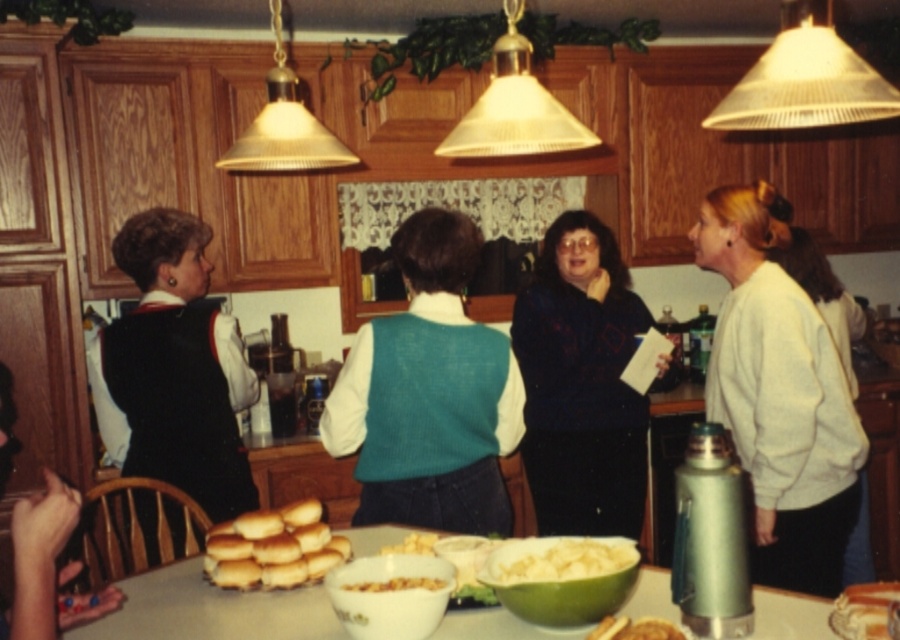
Question: Where is white sweater at right located in relation to smooth orange cake at lower right in the image?

Choices:
 (A) below
 (B) above

Answer: (B)

Question: Is teal knitted vest at center to the left of white creamy mashed potatoes at center from the viewer's perspective?

Choices:
 (A) yes
 (B) no

Answer: (A)

Question: Which of the following is the closest to the observer?

Choices:
 (A) (848, 616)
 (B) (140, 250)
 (C) (293, 573)
 (D) (443, 266)

Answer: (A)

Question: Which point is closer to the camera?

Choices:
 (A) smooth orange cake at lower right
 (B) golden brown bread rolls at center

Answer: (A)

Question: Which point is farther to the camera?

Choices:
 (A) (882, 625)
 (B) (614, 627)
 (C) (546, 560)
 (D) (208, 481)

Answer: (D)

Question: Does white sweater at right appear under smooth orange cake at lower right?

Choices:
 (A) no
 (B) yes

Answer: (A)